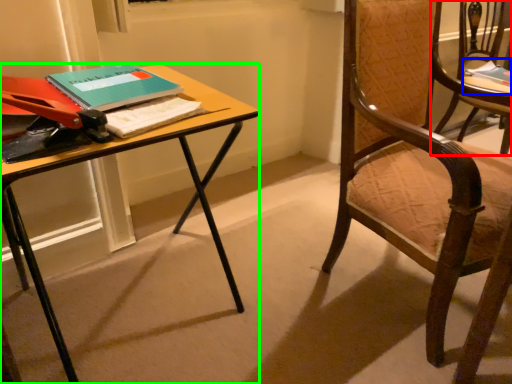
Question: Which object is the closest to the chair (highlighted by a red box)? Choose among these: book (highlighted by a blue box) or desk (highlighted by a green box).

Choices:
 (A) book
 (B) desk

Answer: (A)